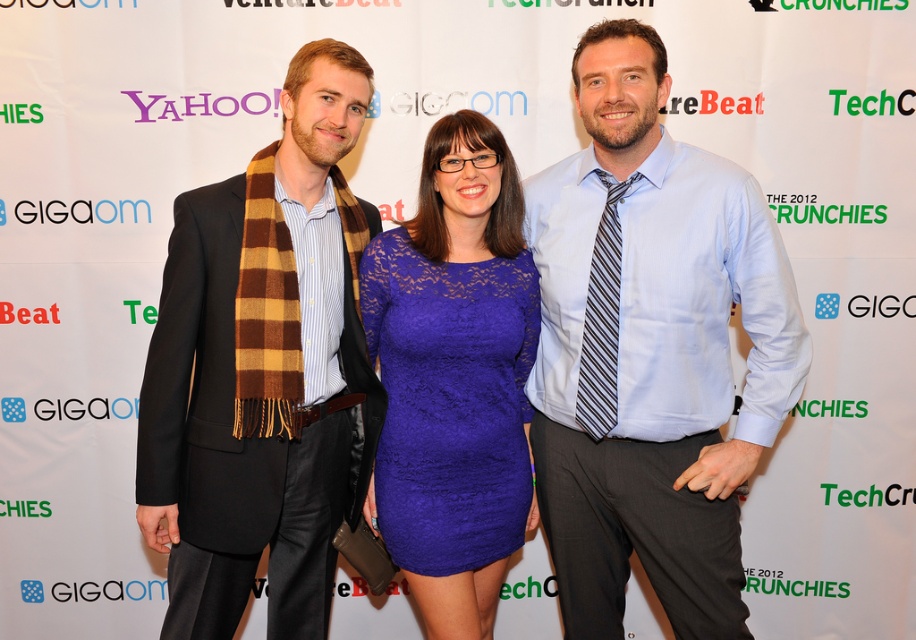
Question: Which is nearer to the brown plaid scarf at left?

Choices:
 (A) light blue shirt at center
 (B) lace blue dress at center

Answer: (B)

Question: Does light blue shirt at center have a larger size compared to brown plaid scarf at left?

Choices:
 (A) yes
 (B) no

Answer: (A)

Question: Where is light blue shirt at center located in relation to brown plaid scarf at left in the image?

Choices:
 (A) left
 (B) right

Answer: (B)

Question: Estimate the real-world distances between objects in this image. Which object is farther from the brown plaid scarf at left?

Choices:
 (A) light blue shirt at center
 (B) lace blue dress at center

Answer: (A)

Question: Estimate the real-world distances between objects in this image. Which object is farther from the light blue shirt at center?

Choices:
 (A) lace blue dress at center
 (B) brown plaid scarf at left

Answer: (B)

Question: Is light blue shirt at center below brown plaid scarf at left?

Choices:
 (A) yes
 (B) no

Answer: (B)